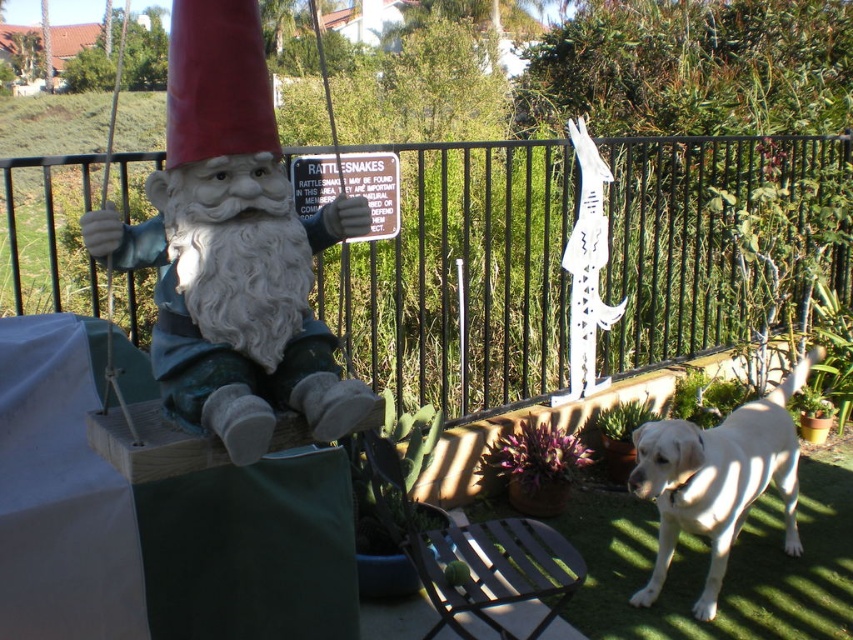
Which is behind, point (639, 428) or point (323, 176)?

Point (323, 176)

Is white fur dog at lower right shorter than metallic silver sign at upper center?

In fact, white fur dog at lower right may be taller than metallic silver sign at upper center.

This screenshot has width=853, height=640. I want to click on white fur dog at lower right, so click(717, 480).

Between black metal fence at upper center and metallic silver sign at upper center, which one has more height?

black metal fence at upper center

Is black metal fence at upper center positioned behind metallic silver sign at upper center?

No, it is in front of metallic silver sign at upper center.

Which is in front, point (437, 259) or point (357, 177)?

Point (357, 177)

This screenshot has width=853, height=640. Find the location of `black metal fence at upper center`. black metal fence at upper center is located at coordinates (463, 276).

Can you confirm if matte ceramic gnome at left is positioned above white fur dog at lower right?

Yes.

Which is above, matte ceramic gnome at left or white fur dog at lower right?

matte ceramic gnome at left

Between point (256, 301) and point (677, 474), which one is positioned in front?

Point (256, 301) is more forward.

Where is `matte ceramic gnome at left`? matte ceramic gnome at left is located at coordinates (233, 248).